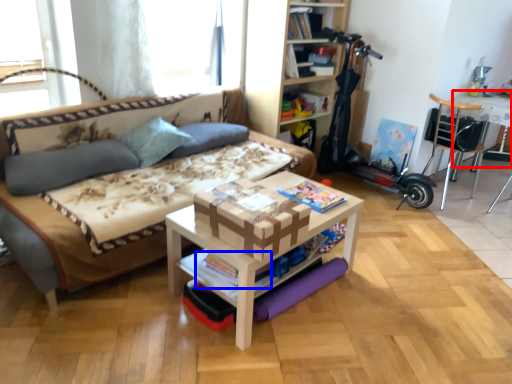
Question: Which object is further to the camera taking this photo, table (highlighted by a red box) or magazine (highlighted by a blue box)?

Choices:
 (A) table
 (B) magazine

Answer: (A)